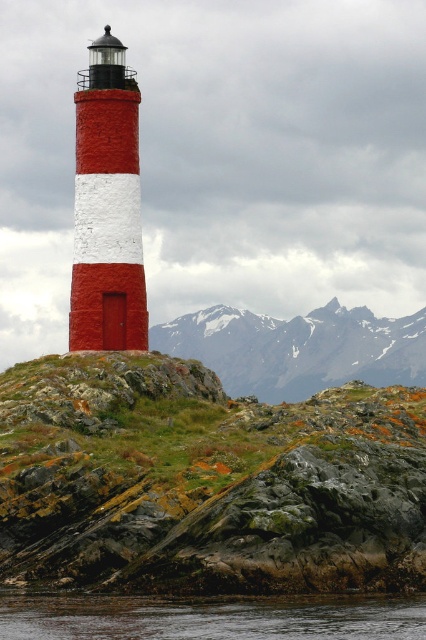
Question: In this image, where is green mossy rock at center located relative to snowy rocky mountain at upper center?

Choices:
 (A) above
 (B) below

Answer: (B)

Question: Which point is farther to the camera?

Choices:
 (A) green mossy rock at center
 (B) transparent water at lower center

Answer: (A)

Question: Does green mossy rock at center have a larger size compared to transparent water at lower center?

Choices:
 (A) no
 (B) yes

Answer: (B)

Question: Does snowy rocky mountain at upper center come in front of transparent water at lower center?

Choices:
 (A) yes
 (B) no

Answer: (B)

Question: Which object is the farthest from the snowy rocky mountain at upper center?

Choices:
 (A) transparent water at lower center
 (B) green mossy rock at center

Answer: (A)

Question: Which is nearer to the snowy rocky mountain at upper center?

Choices:
 (A) transparent water at lower center
 (B) green mossy rock at center

Answer: (B)